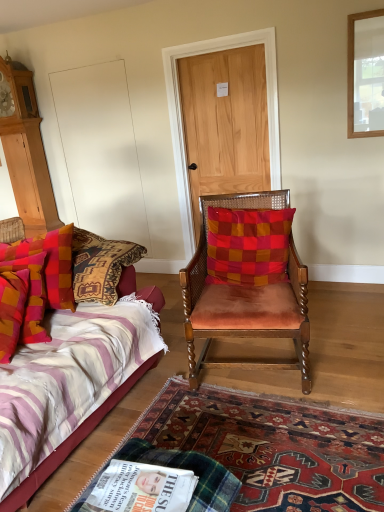
This screenshot has height=512, width=384. What do you see at coordinates (49, 263) in the screenshot?
I see `plaid fabric pillow at left, positioned as the first pillow in left-to-right order` at bounding box center [49, 263].

Identify the location of light brown wood door at center. The image size is (384, 512). click(225, 123).

This screenshot has width=384, height=512. What do you see at coordinates (69, 385) in the screenshot? I see `velvet striped bed at left` at bounding box center [69, 385].

Find the location of `red checkered cushion at center, which ranks as the first pillow in right-to-left order`. red checkered cushion at center, which ranks as the first pillow in right-to-left order is located at coordinates (248, 245).

Measure the distance between red checkered cushion at center, which is the second pillow from left to right, and camera.

red checkered cushion at center, which is the second pillow from left to right, and camera are 7.75 feet apart.

The image size is (384, 512). I want to click on carpeted rug at lower center, so coord(274,446).

Is red checkered cushion at center, which ranks as the first pillow in right-to-left order, far from plaid fabric pillow at left, positioned as the first pillow in left-to-right order?

red checkered cushion at center, which ranks as the first pillow in right-to-left order, is actually quite close to plaid fabric pillow at left, positioned as the first pillow in left-to-right order.

How far apart are red checkered cushion at center, which is the second pillow from left to right, and plaid fabric pillow at left, which appears as the second pillow when viewed from the right?

They are 38.03 inches apart.

Based on the photo, from the image's perspective, is red checkered cushion at center, which ranks as the first pillow in right-to-left order, on plaid fabric pillow at left, which appears as the second pillow when viewed from the right?

Correct, red checkered cushion at center, which ranks as the first pillow in right-to-left order, appears higher than plaid fabric pillow at left, which appears as the second pillow when viewed from the right, in the image.

Between red checkered cushion at center, which is the second pillow from left to right, and plaid fabric pillow at left, which appears as the second pillow when viewed from the right, which one has smaller size?

red checkered cushion at center, which is the second pillow from left to right, is smaller.

Is point (303, 343) more distant than point (116, 481)?

Yes, point (303, 343) is farther from viewer.

How much distance is there between velvet orange chair at center and white glossy magazine at lower center?

velvet orange chair at center and white glossy magazine at lower center are 3.79 feet apart from each other.

In terms of height, does velvet orange chair at center look taller or shorter compared to white glossy magazine at lower center?

velvet orange chair at center is taller than white glossy magazine at lower center.

Are light brown wood door at center and velvet striped bed at left located far from each other?

Indeed, light brown wood door at center is not near velvet striped bed at left.

Based on their positions, is light brown wood door at center located to the left or right of velvet striped bed at left?

From the image, it's evident that light brown wood door at center is to the right of velvet striped bed at left.

Is velvet striped bed at left inside light brown wood door at center?

No, velvet striped bed at left is not inside light brown wood door at center.

Considering the points (267, 151) and (126, 303), which point is in front, point (267, 151) or point (126, 303)?

The point (126, 303) is in front.

From a real-world perspective, who is located higher, white glossy magazine at lower center or light brown wood door at center?

In real-world perspective, light brown wood door at center is above.

Which of these two, white glossy magazine at lower center or light brown wood door at center, is wider?

With larger width is white glossy magazine at lower center.

Between white glossy magazine at lower center and light brown wood door at center, which one has more height?

light brown wood door at center.

From the image's perspective, is white glossy magazine at lower center beneath light brown wood door at center?

Indeed, from the image's perspective, white glossy magazine at lower center is shown beneath light brown wood door at center.

Based on the photo, in the image, is carpeted rug at lower center on the left side or the right side of plaid fabric pillow at left, which appears as the second pillow when viewed from the right?

Based on their positions, carpeted rug at lower center is located to the right of plaid fabric pillow at left, which appears as the second pillow when viewed from the right.

Is the surface of carpeted rug at lower center in direct contact with plaid fabric pillow at left, positioned as the first pillow in left-to-right order?

No, carpeted rug at lower center is not next to plaid fabric pillow at left, positioned as the first pillow in left-to-right order.

Is carpeted rug at lower center spatially inside plaid fabric pillow at left, positioned as the first pillow in left-to-right order, or outside of it?

carpeted rug at lower center lies outside plaid fabric pillow at left, positioned as the first pillow in left-to-right order.

Is carpeted rug at lower center positioned in front of plaid fabric pillow at left, which appears as the second pillow when viewed from the right?

Yes, it is.

Is light brown wood door at center not within carpeted rug at lower center?

Yes, light brown wood door at center is located beyond the bounds of carpeted rug at lower center.

Is light brown wood door at center smaller than carpeted rug at lower center?

No.

Where is `mat below the light brown wood door at center (from the image's perspective)`? mat below the light brown wood door at center (from the image's perspective) is located at coordinates (274, 446).

Between light brown wood door at center and carpeted rug at lower center, which one has more height?

With more height is light brown wood door at center.

Is the depth of velvet striped bed at left less than that of plaid fabric pillow at left, which appears as the second pillow when viewed from the right?

Yes, velvet striped bed at left is in front of plaid fabric pillow at left, which appears as the second pillow when viewed from the right.

In terms of width, does velvet striped bed at left look wider or thinner when compared to plaid fabric pillow at left, positioned as the first pillow in left-to-right order?

In the image, velvet striped bed at left appears to be wider than plaid fabric pillow at left, positioned as the first pillow in left-to-right order.

Does point (45, 245) lie behind point (30, 255)?

Yes, it is.

Is velvet striped bed at left bigger or smaller than plaid fabric pillow at left, positioned as the first pillow in left-to-right order?

Considering their sizes, velvet striped bed at left takes up more space than plaid fabric pillow at left, positioned as the first pillow in left-to-right order.

Identify the location of pillow that is above the plaid fabric pillow at left, which appears as the second pillow when viewed from the right (from the image's perspective). The image size is (384, 512). (248, 245).

Identify the location of magazine on the left side of velvet orange chair at center. (141, 488).

Looking at the image, which one is located further to velvet striped bed at left, plaid fabric pillow at left, positioned as the first pillow in left-to-right order, or red checkered cushion at center, which is the second pillow from left to right?

Based on the image, red checkered cushion at center, which is the second pillow from left to right, appears to be further to velvet striped bed at left.

Based on their spatial positions, is velvet striped bed at left or velvet orange chair at center closer to light brown wood door at center?

Based on the image, velvet orange chair at center appears to be nearer to light brown wood door at center.

Which object lies further to the anchor point white glossy magazine at lower center, light brown wood door at center or velvet orange chair at center?

Among the two, light brown wood door at center is located further to white glossy magazine at lower center.

Based on their spatial positions, is plaid fabric pillow at left, which appears as the second pillow when viewed from the right, or white glossy magazine at lower center further from velvet orange chair at center?

Among the two, white glossy magazine at lower center is located further to velvet orange chair at center.

From the image, which object appears to be farther from plaid fabric pillow at left, positioned as the first pillow in left-to-right order, carpeted rug at lower center or velvet orange chair at center?

The object further to plaid fabric pillow at left, positioned as the first pillow in left-to-right order, is carpeted rug at lower center.

From the image, which object appears to be farther from carpeted rug at lower center, velvet orange chair at center or white glossy magazine at lower center?

white glossy magazine at lower center.

From the image, which object appears to be farther from velvet orange chair at center, red checkered cushion at center, which is the second pillow from left to right, or plaid fabric pillow at left, which appears as the second pillow when viewed from the right?

plaid fabric pillow at left, which appears as the second pillow when viewed from the right, is positioned further to the anchor velvet orange chair at center.

In the scene shown: Estimate the real-world distances between objects in this image. Which object is closer to velvet orange chair at center, velvet striped bed at left or red checkered cushion at center, which ranks as the first pillow in right-to-left order?

red checkered cushion at center, which ranks as the first pillow in right-to-left order, is closer to velvet orange chair at center.

Where is `chair between carpeted rug at lower center and red checkered cushion at center, which is the second pillow from left to right, from front to back`? chair between carpeted rug at lower center and red checkered cushion at center, which is the second pillow from left to right, from front to back is located at coordinates (246, 277).

Identify the location of chair between white glossy magazine at lower center and red checkered cushion at center, which is the second pillow from left to right, in the front-back direction. (246, 277).

Where is `mat between white glossy magazine at lower center and light brown wood door at center from front to back`? The image size is (384, 512). mat between white glossy magazine at lower center and light brown wood door at center from front to back is located at coordinates (274, 446).

Where is `magazine situated between plaid fabric pillow at left, which appears as the second pillow when viewed from the right, and carpeted rug at lower center from left to right`? This screenshot has width=384, height=512. magazine situated between plaid fabric pillow at left, which appears as the second pillow when viewed from the right, and carpeted rug at lower center from left to right is located at coordinates (141, 488).